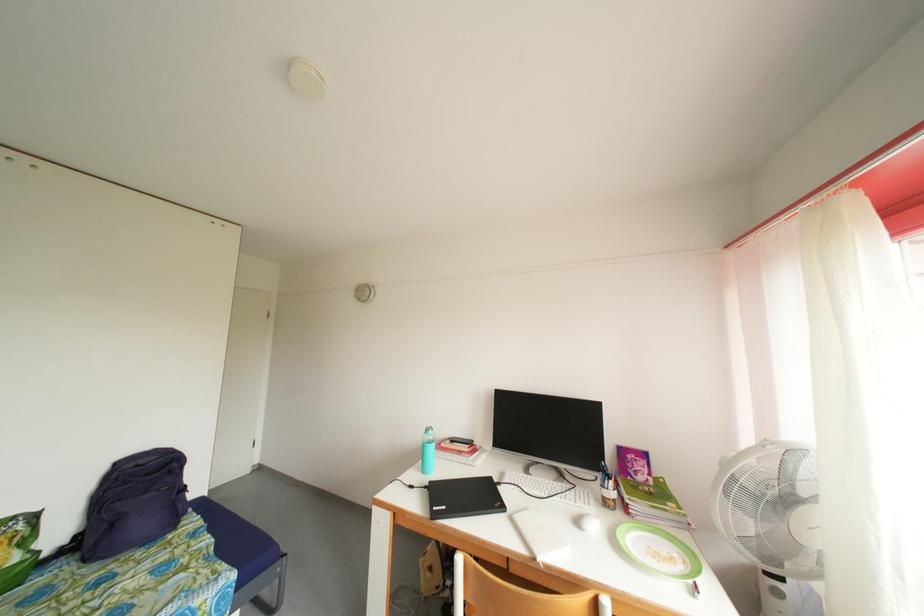
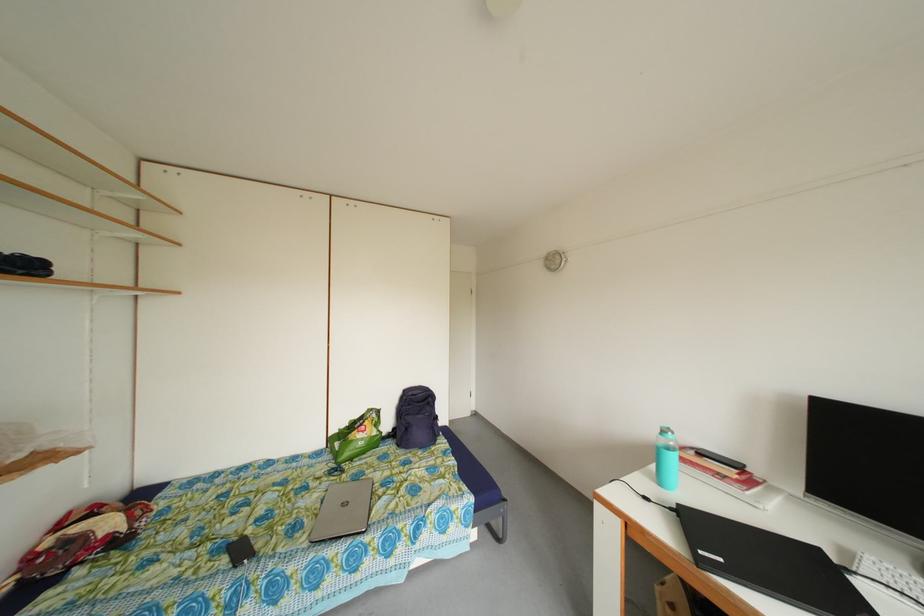
Question: The camera is either moving clockwise (left) or counter-clockwise (right) around the object. The first image is from the beginning of the video and the second image is from the end. Is the camera moving left or right when shooting the video?

Choices:
 (A) Left
 (B) Right

Answer: (B)